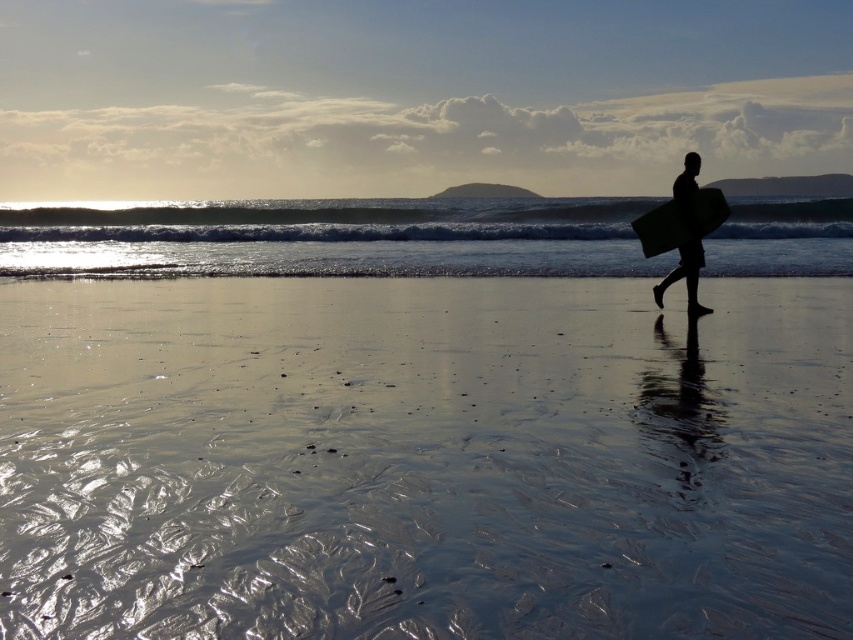
You are standing on the beach and see the shiny sand at lower center and the smooth black surfboard at right. Which object takes up more space in the image?

The shiny sand at lower center has a larger size compared to the smooth black surfboard at right, so it takes up more space in the image.

You are standing at the point with coordinates point [708,230] and want to walk towards the point with coordinates point [370,529]. Which direction should you move?

You should move forward because point [370,529] is in front of point [708,230].